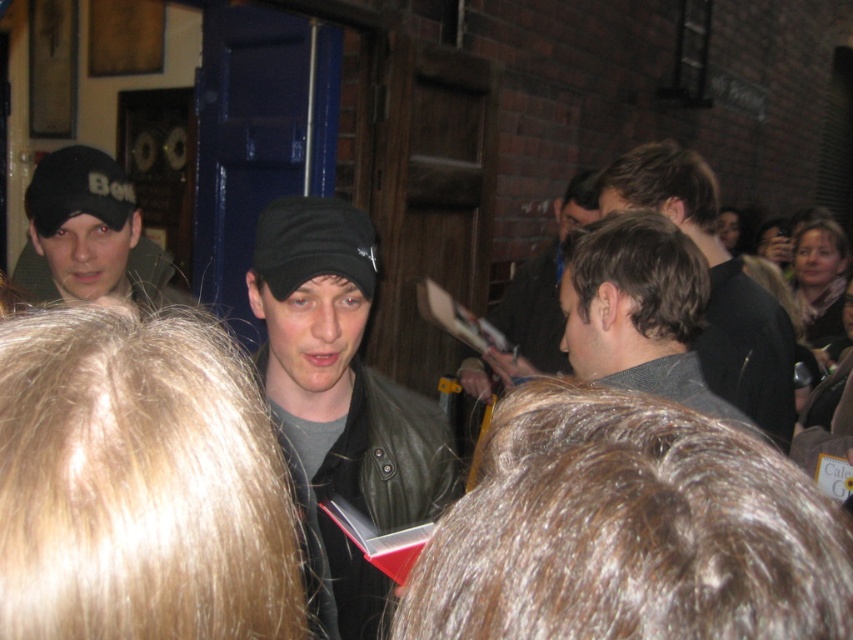
Question: Which of the following is the closest to the observer?

Choices:
 (A) (758, 412)
 (B) (352, 440)
 (C) (514, 305)
 (D) (108, 209)

Answer: (B)

Question: Which point appears farthest from the camera in this image?

Choices:
 (A) (624, 164)
 (B) (270, 232)

Answer: (A)

Question: Which point is closer to the camera?

Choices:
 (A) black leather jacket at center
 (B) black matte cap at left
 (C) dark gray hair at center

Answer: (A)

Question: Does black matte cap at left appear over black matte baseball cap at center?

Choices:
 (A) yes
 (B) no

Answer: (A)

Question: From the image, what is the correct spatial relationship of black leather jacket at center in relation to black matte baseball cap at center?

Choices:
 (A) left
 (B) right

Answer: (B)

Question: Is black matte cap at left below leather jacket at center?

Choices:
 (A) yes
 (B) no

Answer: (A)